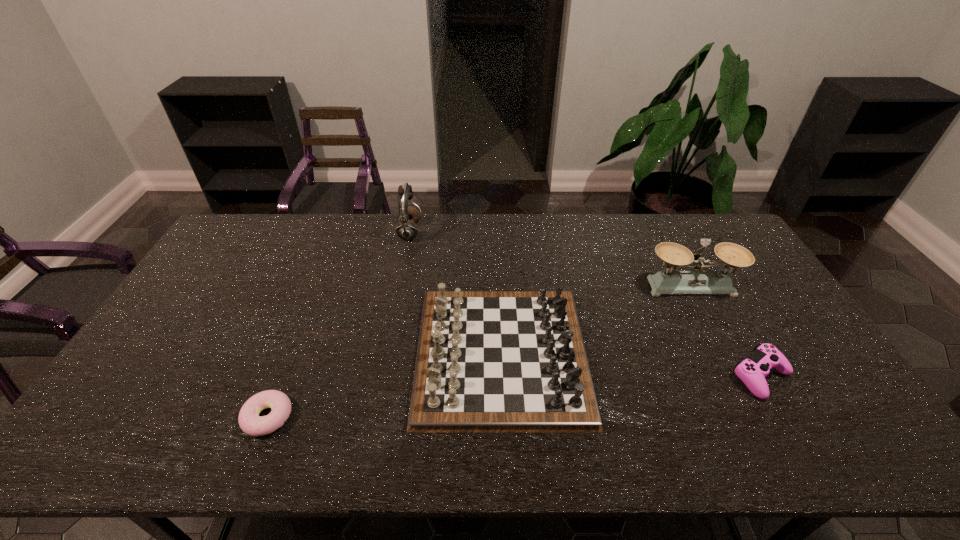
Identify the location of free spot located from the player's perspective of the third object from right to left. The image size is (960, 540). (333, 354).

Identify the location of free space located from the player's perspective of the third object from right to left. The width and height of the screenshot is (960, 540). (392, 354).

Locate an element on the screen. vacant space situated from the player's perspective of the third object from right to left is located at coordinates (380, 354).

Where is `free point located 0.170m on the back of the fourth tallest object`? free point located 0.170m on the back of the fourth tallest object is located at coordinates (723, 309).

I want to click on vacant space located on the left of the doughnut, so click(190, 417).

At what (x,y) coordinates should I click in order to perform the action: click on object located at the far edge. Please return your answer as a coordinate pair (x, y). Looking at the image, I should click on (409, 215).

Where is `chessboard that is positioned at the near edge`? The width and height of the screenshot is (960, 540). chessboard that is positioned at the near edge is located at coordinates (487, 361).

Image resolution: width=960 pixels, height=540 pixels. In order to click on doughnut that is at the near edge in this screenshot , I will do `click(250, 422)`.

Image resolution: width=960 pixels, height=540 pixels. In order to click on scale that is at the right edge in this screenshot , I will do `click(699, 281)`.

Where is `control that is at the right edge`? control that is at the right edge is located at coordinates (752, 371).